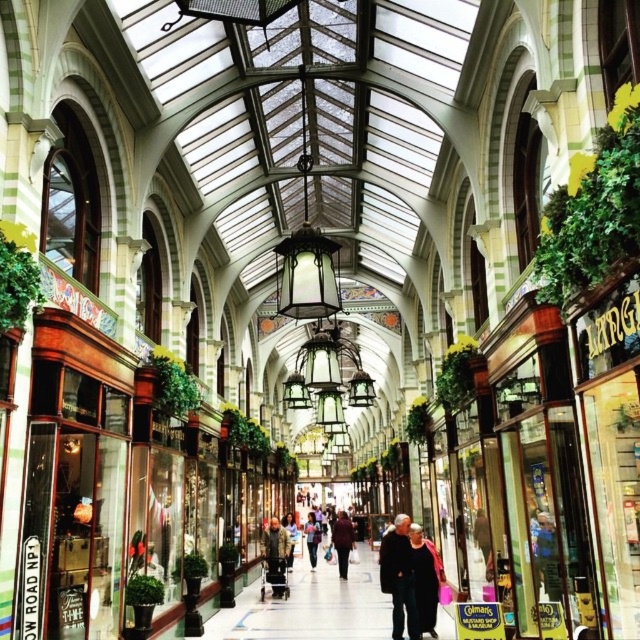
Question: Can you confirm if camouflage jacket at center is wider than dark red sweater at center?

Choices:
 (A) no
 (B) yes

Answer: (B)

Question: Is dark gray coat at center to the right of dark red sweater at center from the viewer's perspective?

Choices:
 (A) yes
 (B) no

Answer: (A)

Question: Among these objects, which one is nearest to the camera?

Choices:
 (A) camouflage jacket at center
 (B) dark gray coat at center
 (C) dark red sweater at center

Answer: (B)

Question: Among these points, which one is nearest to the camera?

Choices:
 (A) 422,579
 (B) 312,516
 (C) 413,604
 (D) 332,524

Answer: (C)

Question: Is camouflage jacket at center bigger than dark red sweater at center?

Choices:
 (A) no
 (B) yes

Answer: (A)

Question: Which is farther from the dark red sweater at center?

Choices:
 (A) dark gray coat at center
 (B) camouflage jacket at center
 (C) dark wool coat at center
 (D) dark blue jeans at center

Answer: (A)